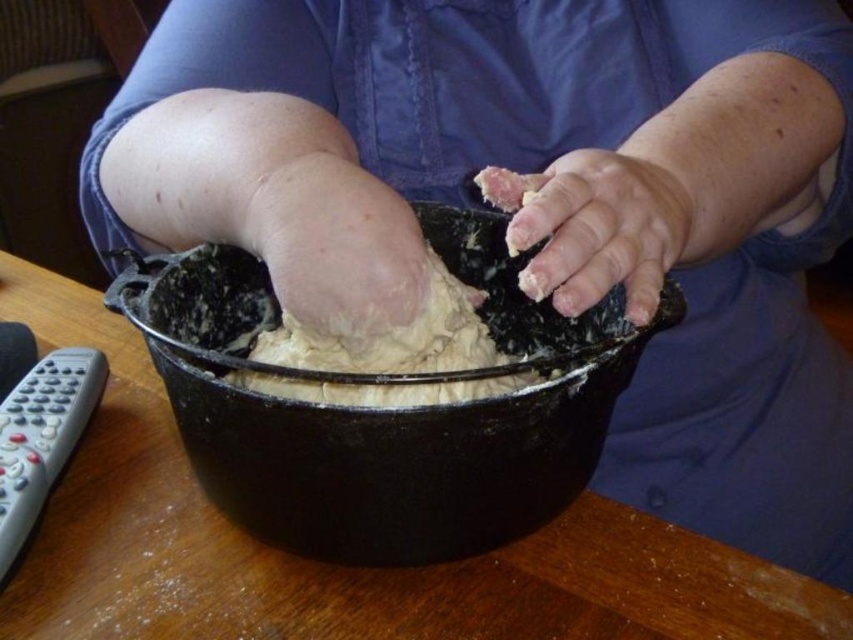
You are a chef trying to locate the black matte bowl at center in the scene. Based on the coordinates provided, where should you look on the table? Please describe the position using the coordinate system where the bottom left corner is the origin point.

The black matte bowl at center is located at coordinates point (386, 410). Since the coordinate system has the bottom left corner as the origin, this means the bowl is positioned approximately 64.1 percent from the left edge and 45.3 percent from the bottom edge of the table.

You are a chef who needs to reach the black matte bowl at center while standing at your current position. Can you comfortably reach it without moving your feet?

The black matte bowl at center is 26.49 centimeters away from the viewer, so yes, the chef can comfortably reach it without moving their feet since that distance is within typical arm reach.

Looking at this image, you are a baker observing someone kneading dough in a black cast iron pot on a wooden table. You notice the pale skin at center and the dry dough at center. Which object is smaller in size?

The pale skin at center is smaller in size compared to the dry dough at center.